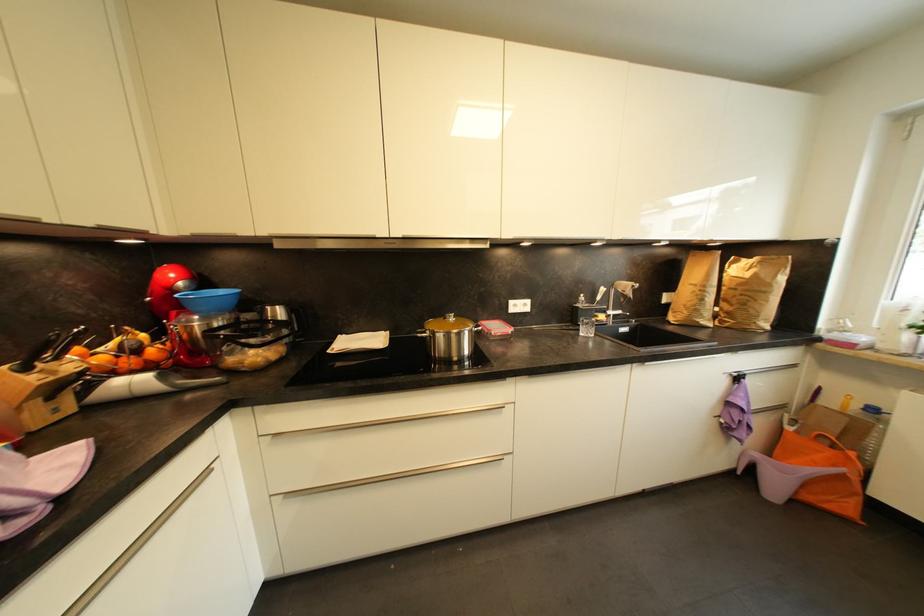
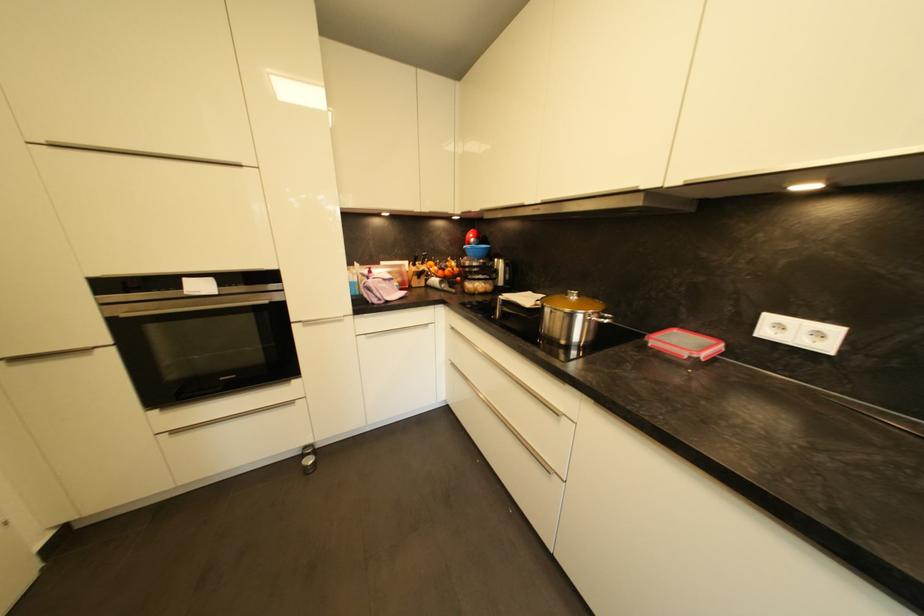
Where in the second image is the point corresponding to point (502, 330) from the first image?

(686, 345)